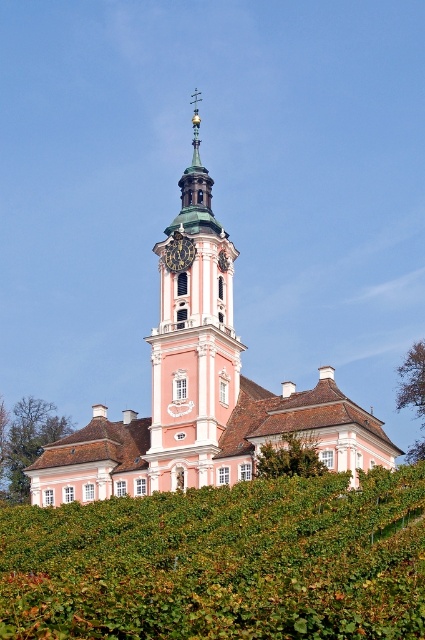
Between pink stucco church at center and gold metallic clock at center, which one has more height?

pink stucco church at center is taller.

Is pink stucco church at center above gold metallic clock at center?

No.

Does point (214, 243) come farther from viewer compared to point (189, 244)?

Yes.

At what (x,y) coordinates should I click in order to perform the action: click on pink stucco church at center. Please return your answer as a coordinate pair (x, y). Looking at the image, I should click on (203, 390).

Who is higher up, pink stucco tower at center or gold metallic clock at center?

pink stucco tower at center is higher up.

This screenshot has height=640, width=425. I want to click on pink stucco tower at center, so click(195, 346).

Between point (408, 586) and point (184, 429), which one is positioned behind?

The point (184, 429) is behind.

From the picture: Who is positioned more to the right, green leafy hedge at lower center or pink stucco church at center?

green leafy hedge at lower center

At what (x,y) coordinates should I click in order to perform the action: click on green leafy hedge at lower center. Please return your answer as a coordinate pair (x, y). The width and height of the screenshot is (425, 640). Looking at the image, I should click on (223, 563).